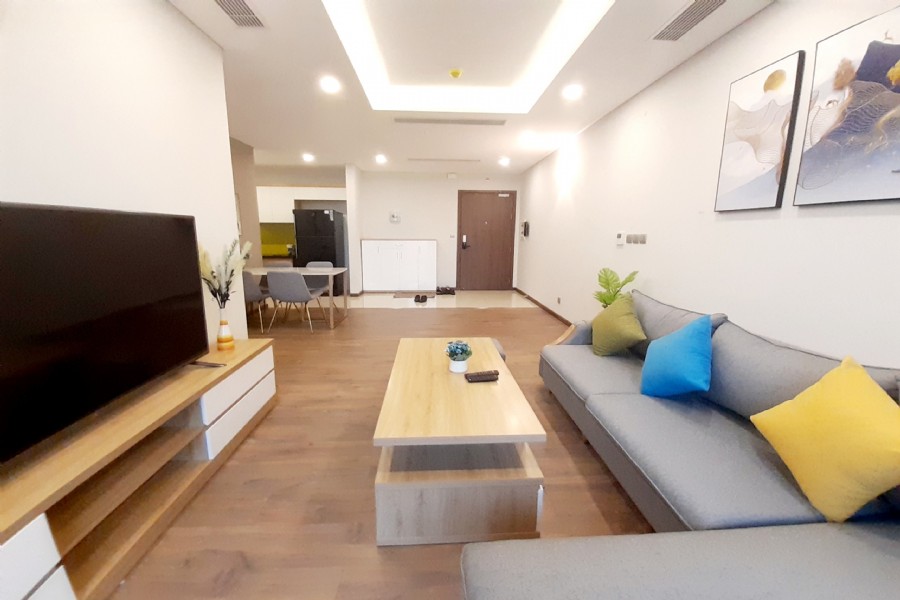
Find the location of `kitchen table`. kitchen table is located at coordinates (325, 272).